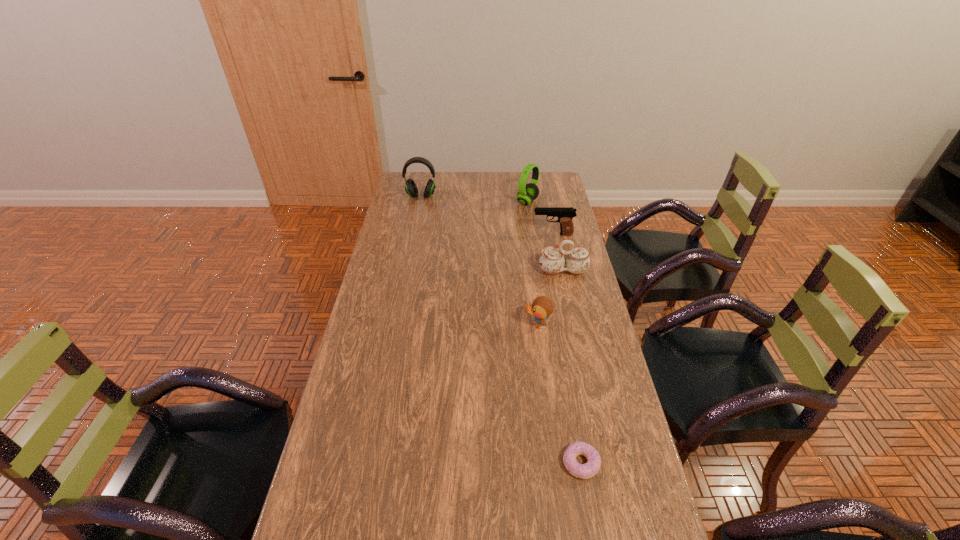
Where is `free space between the duck and the leftmost object`? This screenshot has height=540, width=960. free space between the duck and the leftmost object is located at coordinates (479, 260).

This screenshot has width=960, height=540. Identify the location of empty location between the nearest object and the pistol. pyautogui.click(x=567, y=349).

Locate an element on the screen. Image resolution: width=960 pixels, height=540 pixels. free space between the left headset and the right headset is located at coordinates [474, 199].

Identify the location of empty space that is in between the chinaware and the leftmost object. This screenshot has width=960, height=540. (492, 234).

The height and width of the screenshot is (540, 960). In order to click on vacant area that lies between the chinaware and the nearest object in this screenshot , I will do `click(572, 367)`.

This screenshot has height=540, width=960. Identify the location of free space that is in between the chinaware and the nearest object. (572, 367).

You are a GUI agent. You are given a task and a screenshot of the screen. Output one action in this format:
    pyautogui.click(x=<x>, y=<y>)
    Task: Click on the free space between the duck and the chinaware
    The height and width of the screenshot is (540, 960).
    Given the screenshot: What is the action you would take?
    pyautogui.click(x=550, y=298)

Find the location of a particular element. object identified as the fourth closest to the chinaware is located at coordinates (411, 189).

Image resolution: width=960 pixels, height=540 pixels. Identify the location of object that ranks as the fifth closest to the right headset. (583, 471).

Image resolution: width=960 pixels, height=540 pixels. Identify the location of free spot that satisfies the following two spatial constraints: 1. on the ear cups of the leftmost object; 2. on the right side of the right headset. (420, 202).